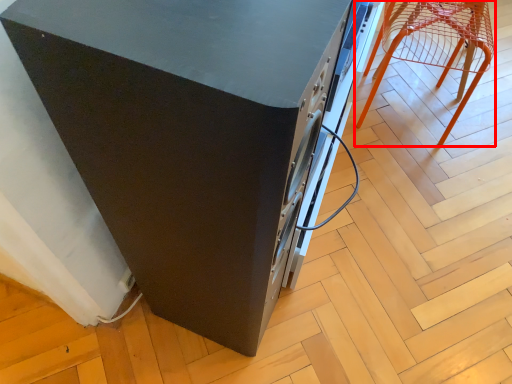
Question: Observing the image, what is the correct spatial positioning of furniture (annotated by the red box) in reference to home appliance?

Choices:
 (A) left
 (B) right

Answer: (B)